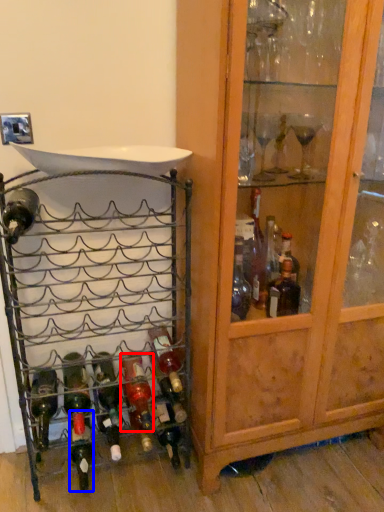
Question: Which object appears farthest to the camera in this image, bottle (highlighted by a red box) or bottle (highlighted by a blue box)?

Choices:
 (A) bottle
 (B) bottle

Answer: (B)